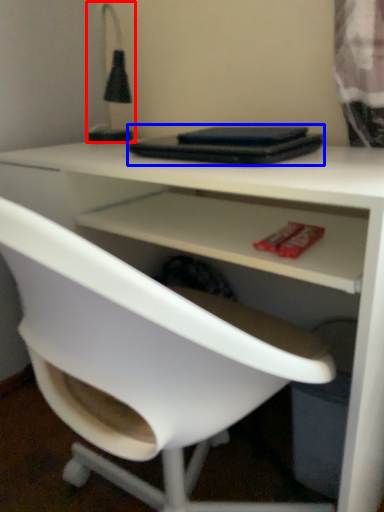
Question: Which point is further to the camera, table lamp (highlighted by a red box) or laptop (highlighted by a blue box)?

Choices:
 (A) table lamp
 (B) laptop

Answer: (A)